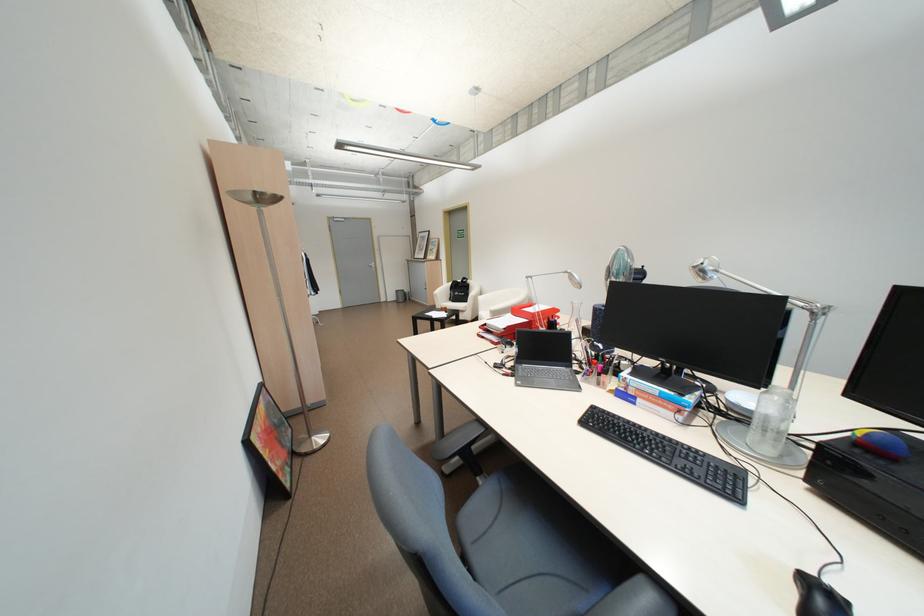
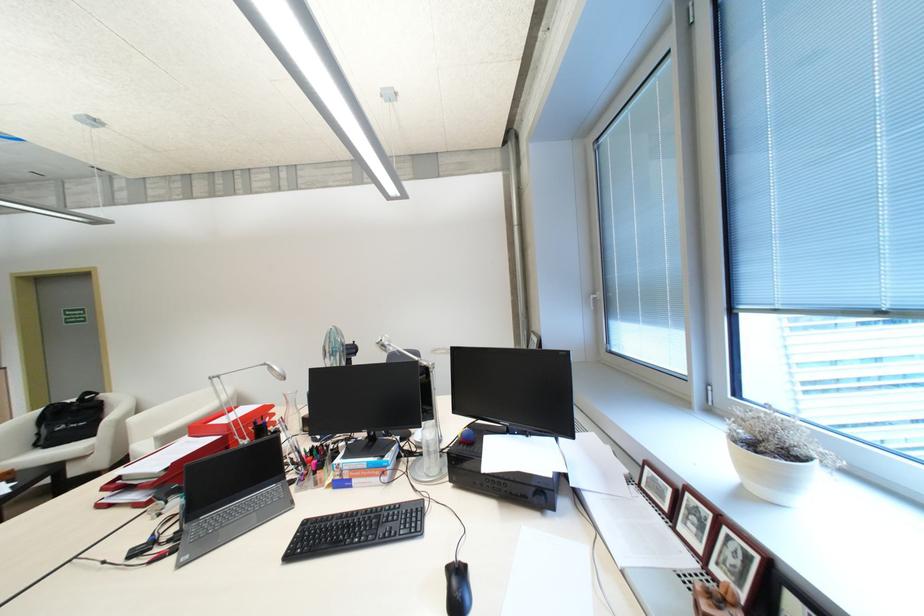
Locate, in the second image, the point that corresponds to pixel 469 280 in the first image.

(82, 399)